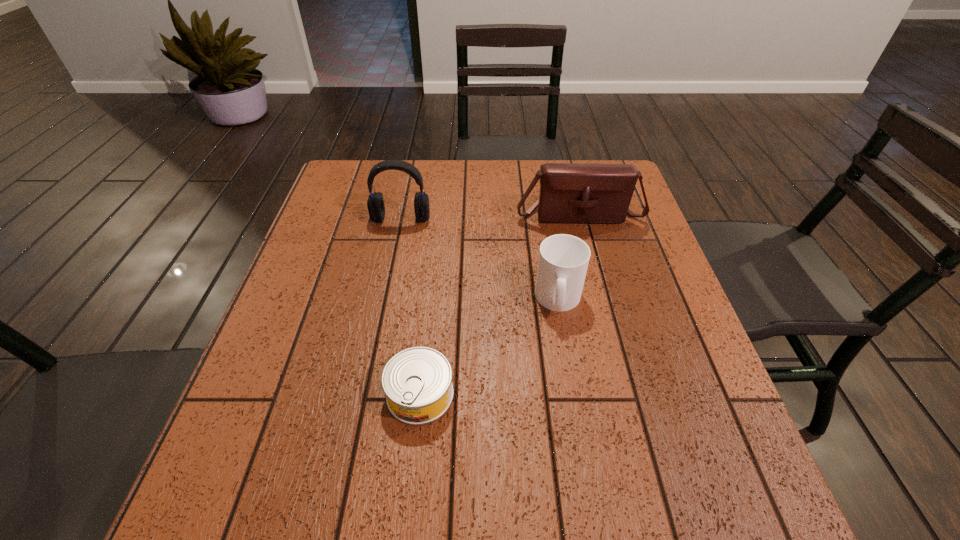
The image size is (960, 540). What are the coordinates of `vacant space in between the headset and the mug` in the screenshot? It's located at (480, 259).

Locate an element on the screen. The width and height of the screenshot is (960, 540). free space between the shoulder bag and the headset is located at coordinates tap(490, 216).

Identify the location of vacant space that is in between the nearest object and the headset. This screenshot has width=960, height=540. (411, 306).

Identify the location of free space between the headset and the second shortest object. (480, 259).

Identify the location of empty location between the headset and the nearest object. This screenshot has width=960, height=540. (411, 306).

What are the coordinates of `free area in between the shortest object and the headset` in the screenshot? It's located at (411, 306).

Identify the location of free space between the can and the mug. Image resolution: width=960 pixels, height=540 pixels. (490, 347).

Where is `free space between the headset and the shortest object`? Image resolution: width=960 pixels, height=540 pixels. free space between the headset and the shortest object is located at coordinates coord(411,306).

Locate an element on the screen. The height and width of the screenshot is (540, 960). object that stands as the second closest to the headset is located at coordinates (563, 260).

Locate an element on the screen. This screenshot has height=540, width=960. object that stands as the closest to the shoulder bag is located at coordinates (563, 260).